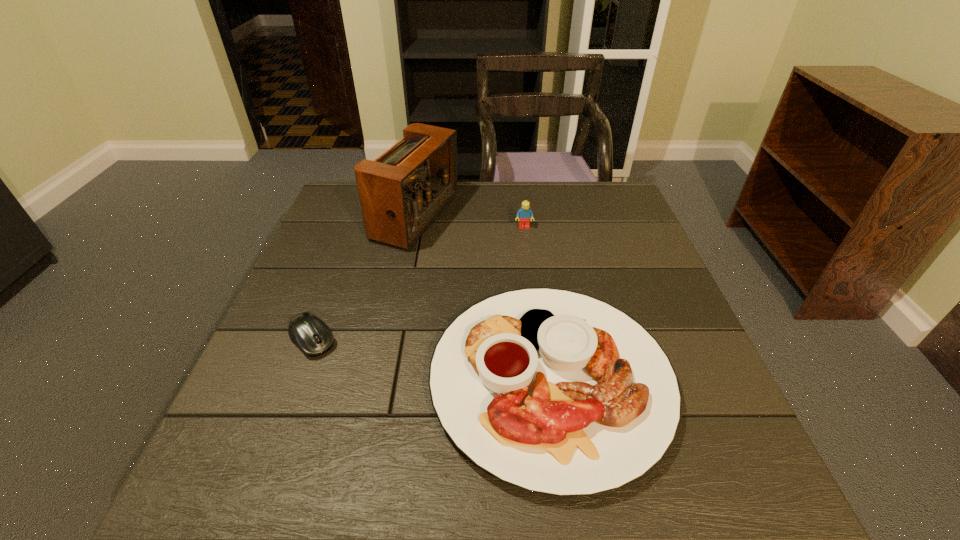
Locate an element on the screen. The image size is (960, 540). the tallest object is located at coordinates [x=402, y=192].

What are the coordinates of `the third shortest object` in the screenshot? It's located at point(523,215).

The width and height of the screenshot is (960, 540). Identify the location of platter. tap(556, 392).

Identify the location of the shortest object. (310, 334).

Find the location of a particular element. vacant space located on the right of the tallest object is located at coordinates (545, 217).

Locate an element on the screen. The height and width of the screenshot is (540, 960). vacant region located on the face of the Lego is located at coordinates (531, 284).

Where is `vacant area located 0.240m on the left of the platter`? Image resolution: width=960 pixels, height=540 pixels. vacant area located 0.240m on the left of the platter is located at coordinates (308, 380).

Identify the location of vacant space located on the front of the mouse. (275, 442).

Find the location of a particular element. This screenshot has width=960, height=540. object present at the far edge is located at coordinates (402, 192).

Where is `object located at the near edge`? The width and height of the screenshot is (960, 540). object located at the near edge is located at coordinates (556, 392).